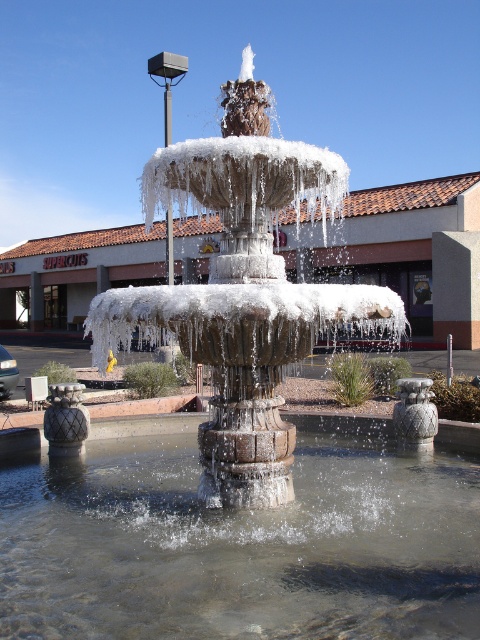
Question: Is clear water at center positioned at the back of icy stone fountain at center?

Choices:
 (A) yes
 (B) no

Answer: (A)

Question: Is icy stone fountain at center to the left of white ice fountain at center from the viewer's perspective?

Choices:
 (A) yes
 (B) no

Answer: (B)

Question: Does clear water at center have a smaller size compared to white ice fountain at center?

Choices:
 (A) no
 (B) yes

Answer: (B)

Question: Estimate the real-world distances between objects in this image. Which object is closer to the white ice fountain at center?

Choices:
 (A) clear water at center
 (B) icy stone fountain at center

Answer: (B)

Question: Which of the following is the farthest from the observer?

Choices:
 (A) (218, 396)
 (B) (45, 248)

Answer: (B)

Question: Which object is farther from the camera taking this photo?

Choices:
 (A) clear water at center
 (B) white ice fountain at center

Answer: (B)